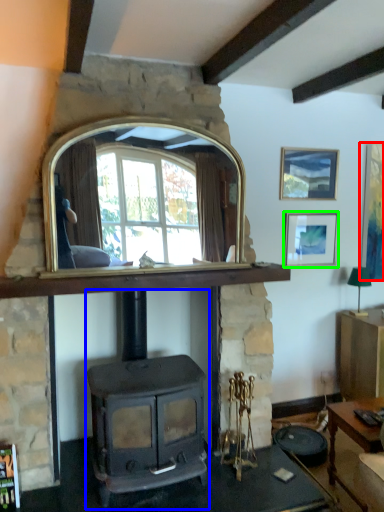
Question: Which is nearer to the picture frame (highlighted by a red box)? wood burning stove (highlighted by a blue box) or picture frame (highlighted by a green box).

Choices:
 (A) wood burning stove
 (B) picture frame

Answer: (B)